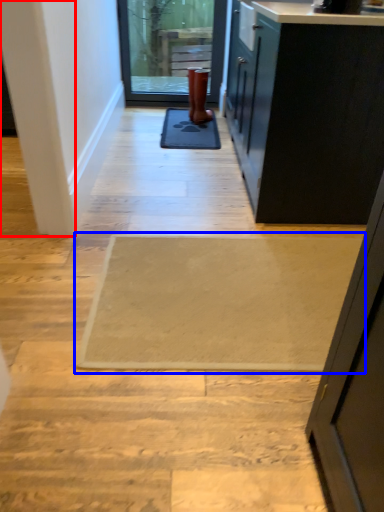
Question: Among these objects, which one is farthest to the camera, pillar (highlighted by a red box) or yoga mat (highlighted by a blue box)?

Choices:
 (A) pillar
 (B) yoga mat

Answer: (B)